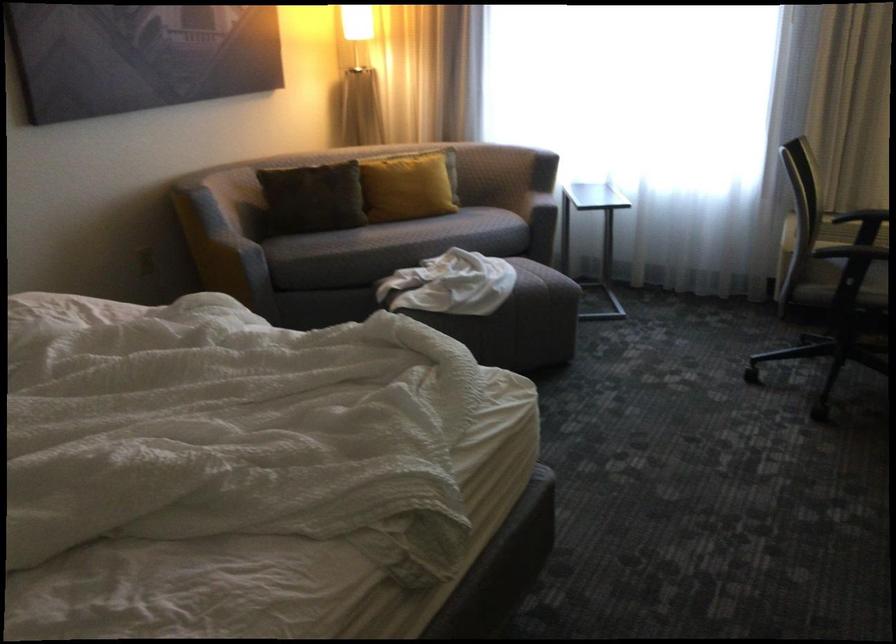
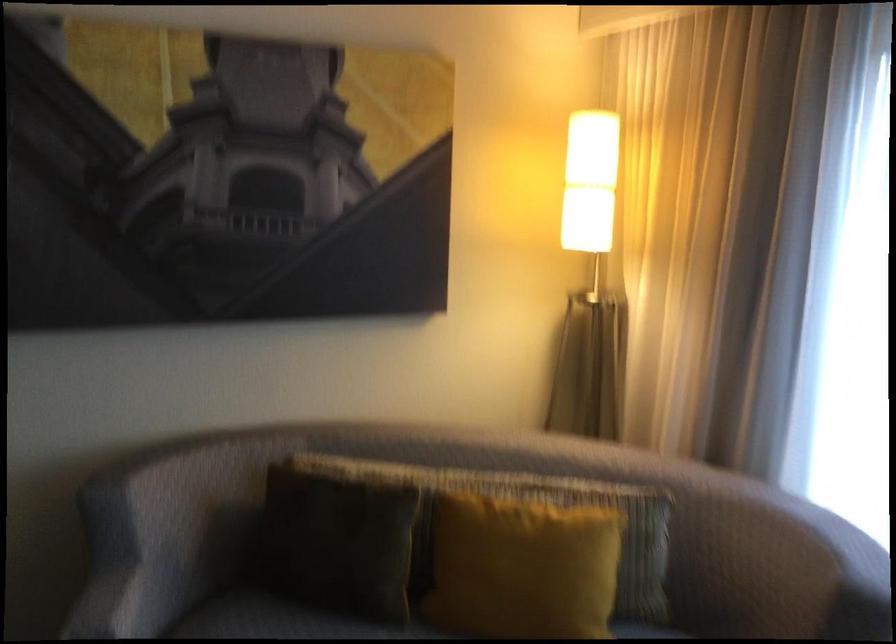
Locate, in the second image, the point that corresponds to pixel 410 176 in the first image.

(522, 567)